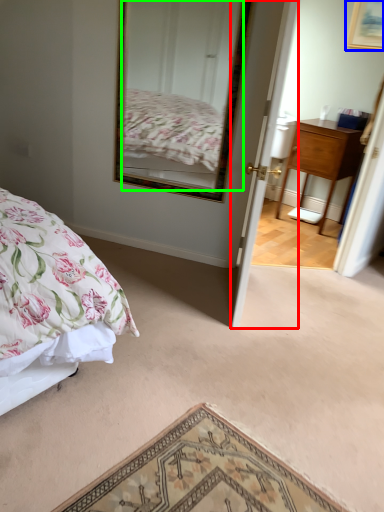
Question: Estimate the real-world distances between objects in this image. Which object is closer to door (highlighted by a red box), picture frame (highlighted by a blue box) or mirror (highlighted by a green box)?

Choices:
 (A) picture frame
 (B) mirror

Answer: (B)